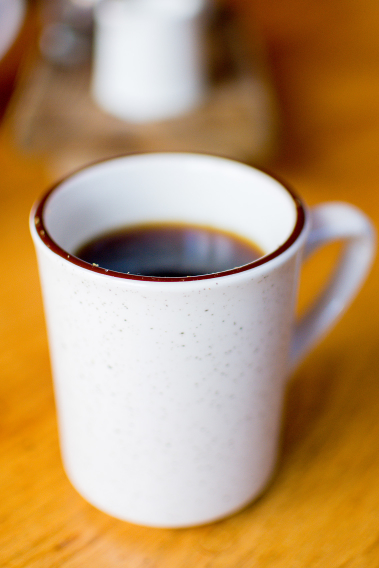
Locate an element on the screen. The image size is (379, 568). handle is located at coordinates (337, 290).